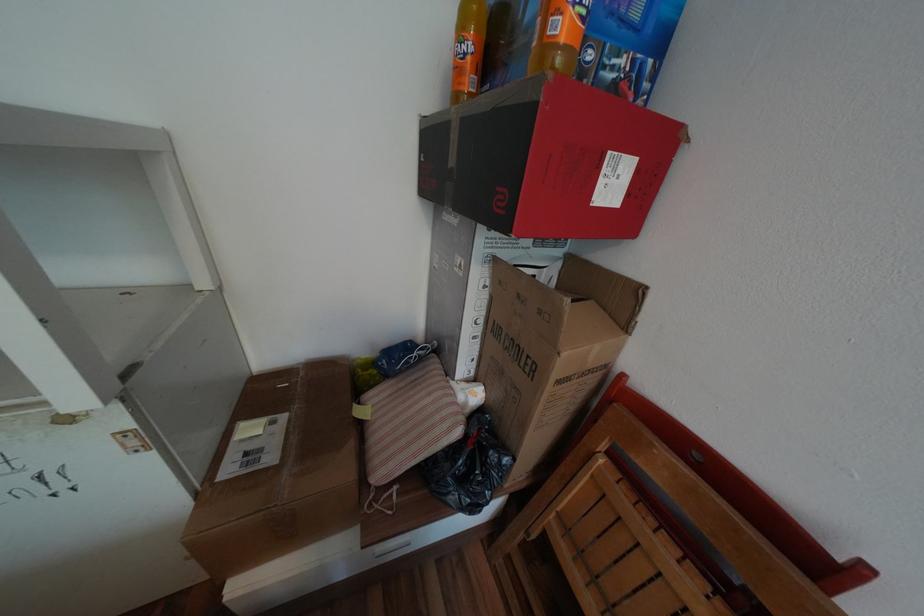
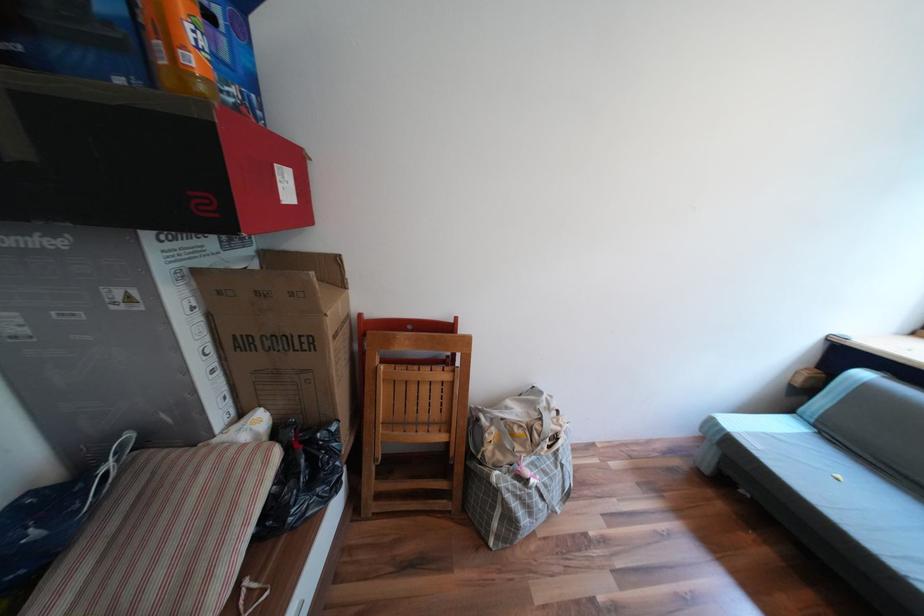
In the second image, find the point that corresponds to [611,182] in the first image.

(289, 185)